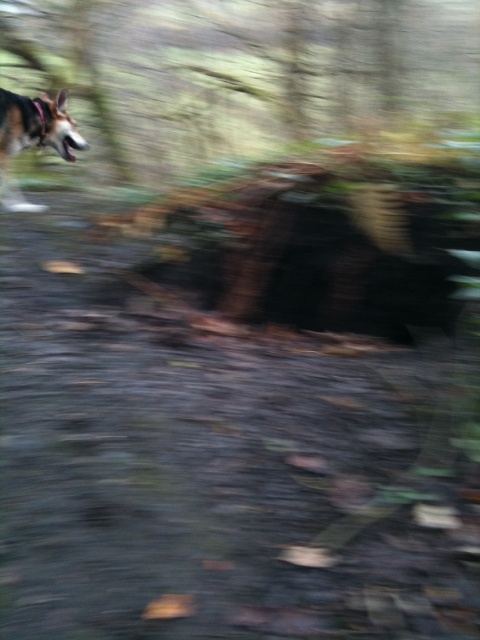
Question: Does brown rough bark at upper left lie behind brown fur dog at left?

Choices:
 (A) no
 (B) yes

Answer: (B)

Question: Which point is closer to the camera taking this photo?

Choices:
 (A) (290, 93)
 (B) (34, 120)

Answer: (B)

Question: Does brown rough bark at upper left have a larger size compared to brown fur dog at left?

Choices:
 (A) no
 (B) yes

Answer: (B)

Question: Considering the relative positions of brown rough bark at upper left and brown fur dog at left in the image provided, where is brown rough bark at upper left located with respect to brown fur dog at left?

Choices:
 (A) above
 (B) below

Answer: (A)